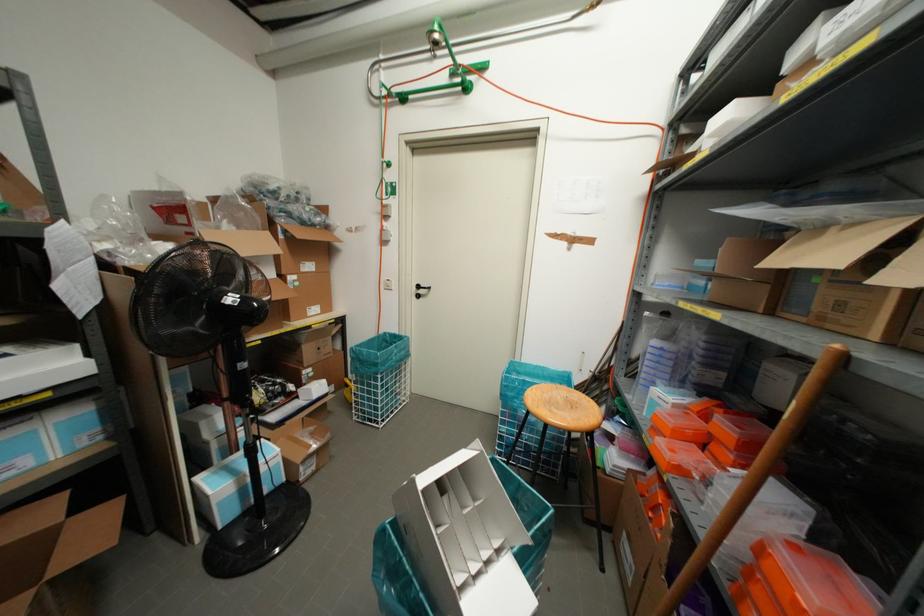
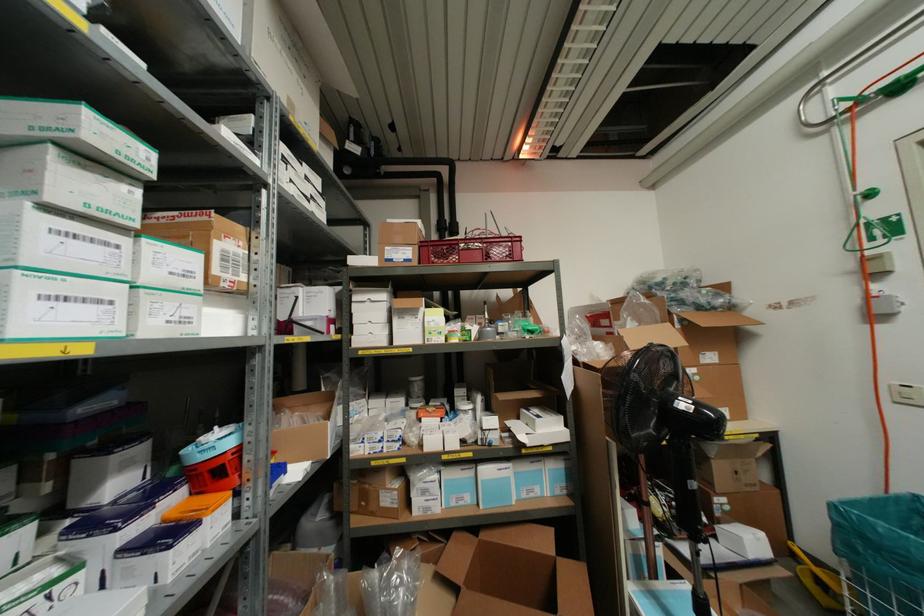
Locate, in the second image, the point that corresponds to (388,94) in the first image.

(859, 100)